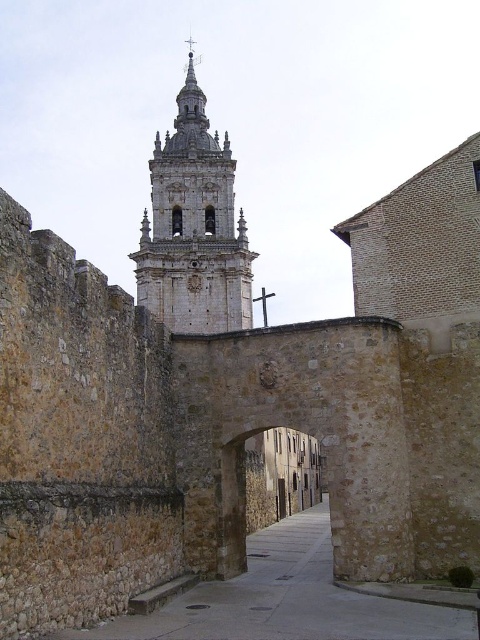
Who is more forward, [375,618] or [228,328]?

Point [375,618] is in front.

Between smooth stone alley at center and white stone tower at center, which one appears on the right side from the viewer's perspective?

Positioned to the right is smooth stone alley at center.

The height and width of the screenshot is (640, 480). Describe the element at coordinates (286, 600) in the screenshot. I see `smooth stone alley at center` at that location.

The height and width of the screenshot is (640, 480). I want to click on smooth stone alley at center, so click(x=286, y=600).